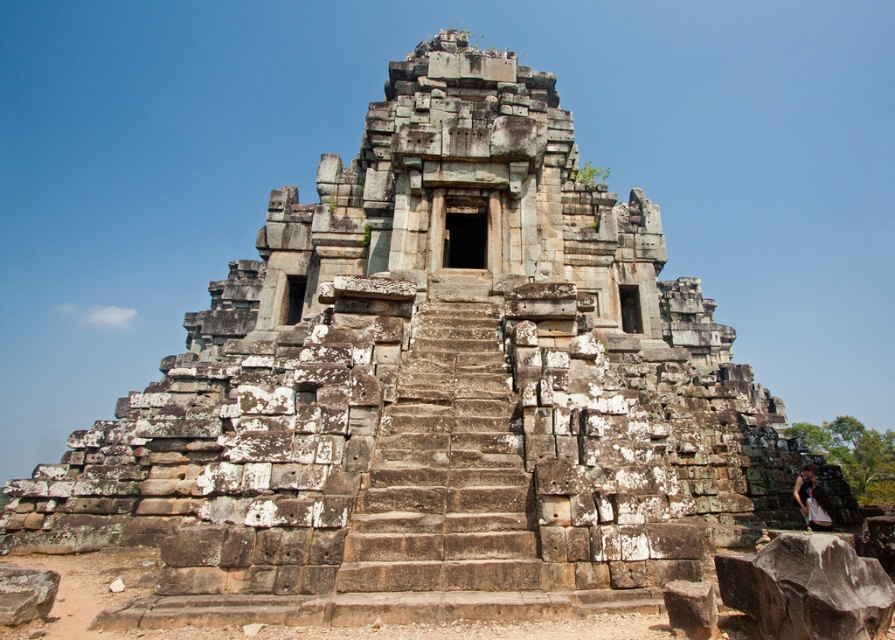
Question: Does brown stone stairs at center have a greater width compared to white cotton dress at lower right?

Choices:
 (A) no
 (B) yes

Answer: (B)

Question: In this image, where is brown stone stairs at center located relative to white cotton dress at lower right?

Choices:
 (A) above
 (B) below

Answer: (A)

Question: Which point appears farthest from the camera in this image?

Choices:
 (A) (527, 492)
 (B) (821, 496)

Answer: (B)

Question: Is brown stone stairs at center behind white cotton dress at lower right?

Choices:
 (A) yes
 (B) no

Answer: (B)

Question: Which point is farther to the camera?

Choices:
 (A) (486, 368)
 (B) (824, 492)

Answer: (B)